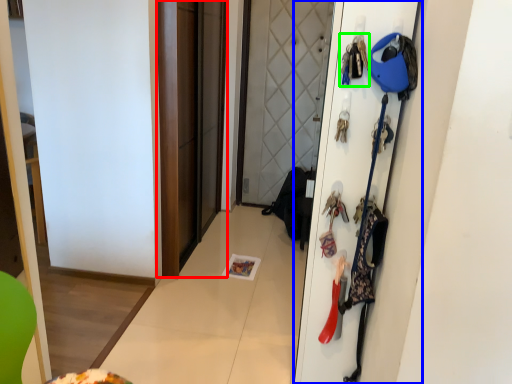
Question: Which object is positioned closest to screen door (highlighted by a red box)? Select from door (highlighted by a blue box) and accessory (highlighted by a green box).

Choices:
 (A) door
 (B) accessory

Answer: (A)